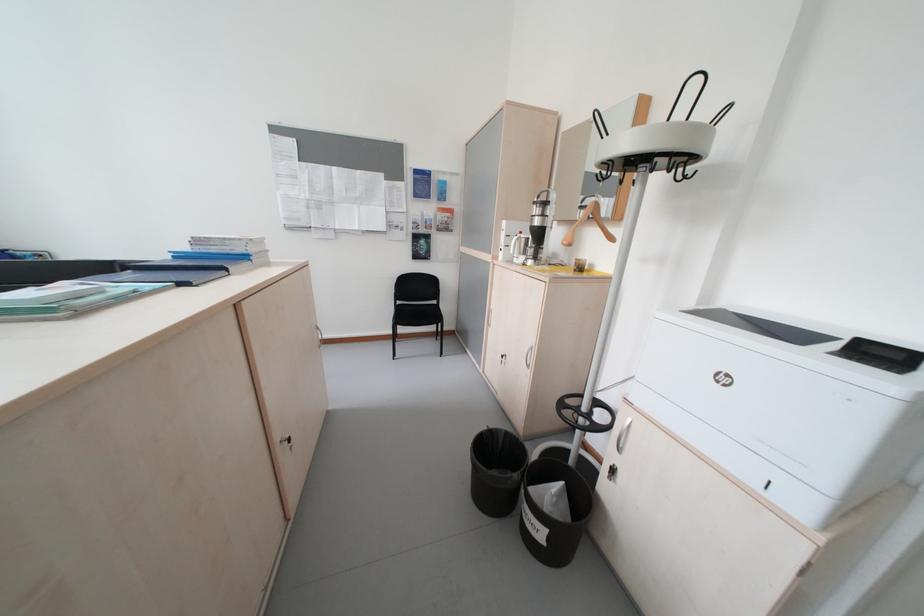
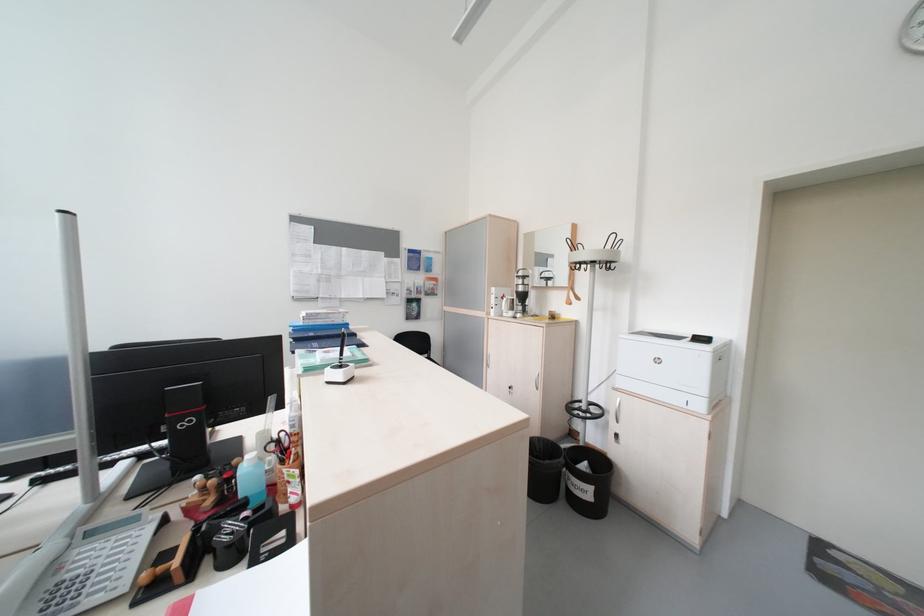
Locate, in the second image, the point that corresponds to point 556,532 in the first image.

(602, 490)